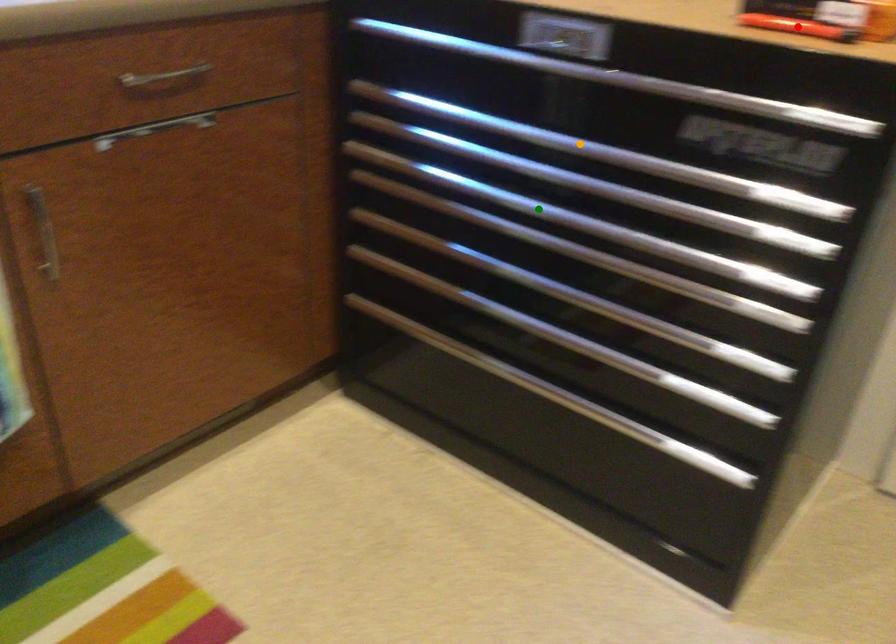
Order these from nearest to farthest:
green point | red point | orange point

green point
orange point
red point